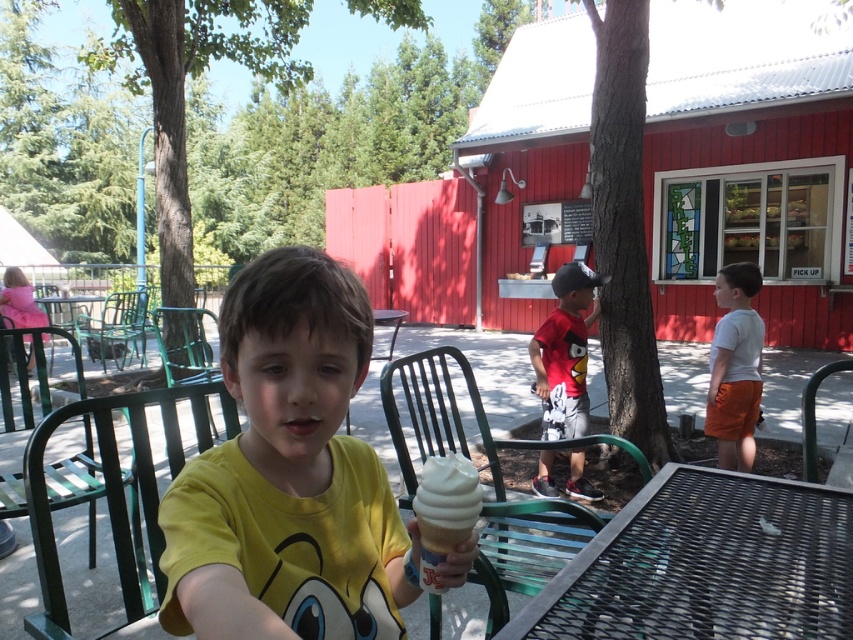
You are a parent trying to seat your child at the green metal table at left. Your child is 1.2 meters tall. The chair you have is 0.8 meters tall. Do you need to adjust the height of the green metal chair at lower center for your child to sit comfortably?

The green metal chair at lower center is taller than the green metal table at left. Since the chair is already taller than the table, and the child is 1.2 meters tall, the chair at 0.8 meters may be too short. However, the existing green metal chair at lower center is taller, so using it would provide a better fit for the child to comfortably reach the table.

You are a maintenance worker at the park and need to move the green metal chair at lower center to the green metal table at left. Can you do it without needing to use a cart? The maximum distance you can carry a chair is 8 meters.

The green metal chair at lower center and green metal table at left are 8.18 meters apart, which is beyond your 8 meter carrying limit. You will need to use a cart to move the green metal chair at lower center to the green metal table at left.

You are a maintenance worker needing to move a 6.5 feet long ladder from the storage area to the work site. You have to pass through the space between the black metal table at lower right and the green metal chair at lower left. Can the ladder fit through that space?

The distance between the black metal table at lower right and the green metal chair at lower left is 6.45 feet. Since the ladder is 6.5 feet long, it is slightly longer than the available space, so the ladder cannot fit through that space.